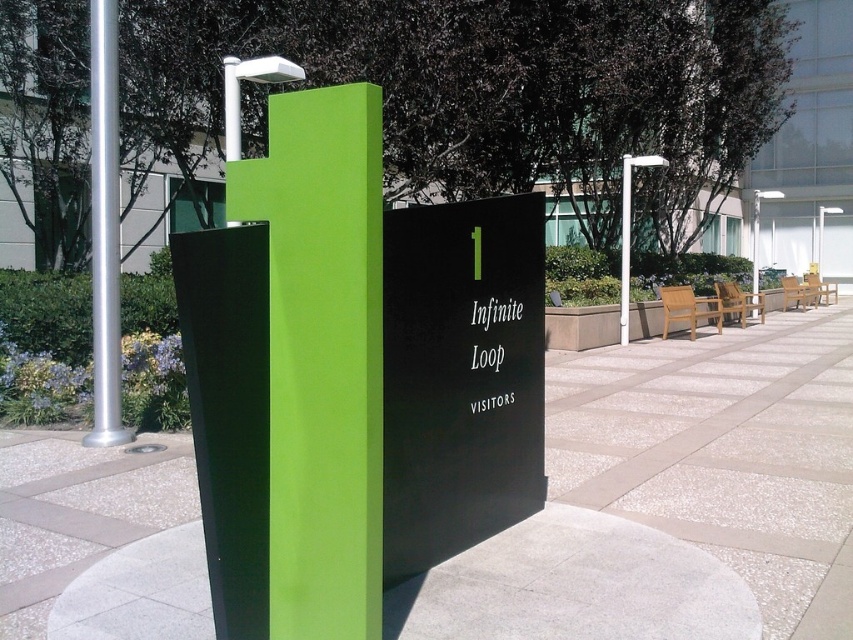
Is lime green matte pillar at center in front of white plastic pole at center?

Yes, it is in front of white plastic pole at center.

Where is `lime green matte pillar at center`? lime green matte pillar at center is located at coordinates (322, 356).

Is point (329, 227) in front of point (622, 250)?

Yes, it is in front of point (622, 250).

Find the location of a particular element. The width and height of the screenshot is (853, 640). lime green matte pillar at center is located at coordinates (322, 356).

Can you confirm if silver metallic pole at left is shorter than white plastic pole at center?

Incorrect, silver metallic pole at left's height does not fall short of white plastic pole at center's.

In the scene shown: Who is lower down, silver metallic pole at left or white plastic pole at center?

silver metallic pole at left is lower down.

Is point (107, 93) closer to viewer compared to point (625, 248)?

That is True.

Locate an element on the screen. This screenshot has height=640, width=853. silver metallic pole at left is located at coordinates (105, 227).

Based on the photo, between lime green matte pillar at center and silver metallic pole at left, which one appears on the right side from the viewer's perspective?

lime green matte pillar at center

Between lime green matte pillar at center and silver metallic pole at left, which one has more height?

silver metallic pole at left

Between point (361, 392) and point (103, 26), which one is positioned in front?

Point (361, 392) is more forward.

The image size is (853, 640). I want to click on lime green matte pillar at center, so click(x=322, y=356).